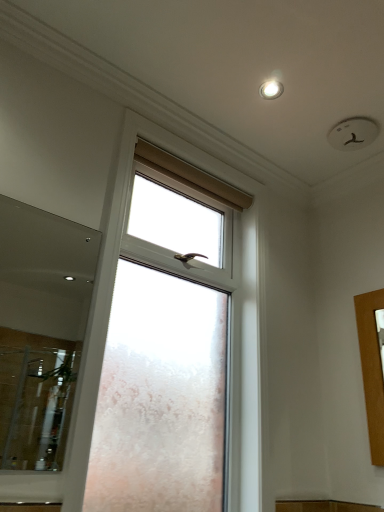
Where is `frosted glass window at center`? The width and height of the screenshot is (384, 512). frosted glass window at center is located at coordinates (113, 285).

What do you see at coordinates (113, 285) in the screenshot?
I see `frosted glass window at center` at bounding box center [113, 285].

In order to face frosted glass window at center, should I rotate leftwards or rightwards?

You should rotate left by 0.662 degrees.

Locate an element on the screen. The height and width of the screenshot is (512, 384). frosted glass window at center is located at coordinates (113, 285).